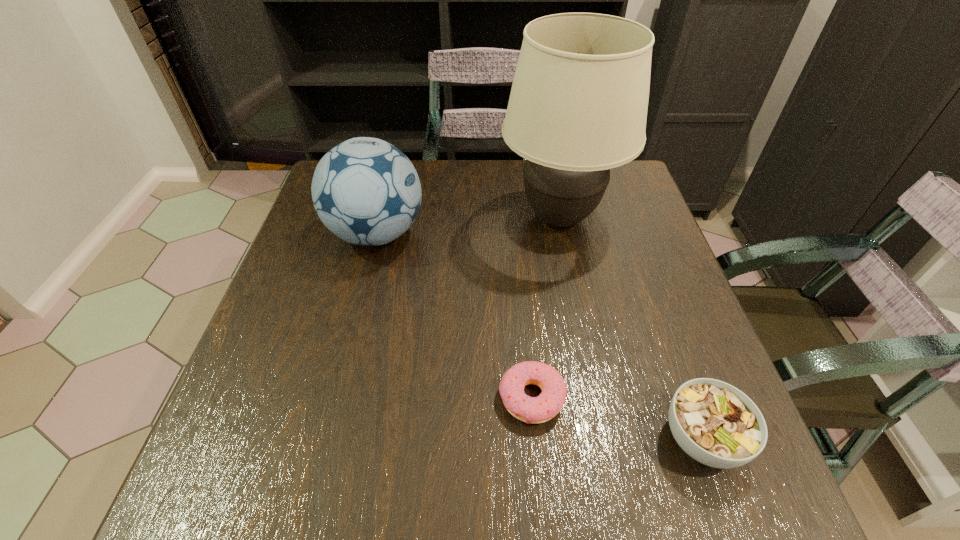
This screenshot has height=540, width=960. Identify the location of the tallest object. (578, 105).

Where is `the leftmost object`? This screenshot has width=960, height=540. the leftmost object is located at coordinates (366, 191).

The height and width of the screenshot is (540, 960). In order to click on soccer ball in this screenshot , I will do `click(366, 191)`.

At what (x,y) coordinates should I click in order to perform the action: click on the second shortest object. Please return your answer as a coordinate pair (x, y). Looking at the image, I should click on (715, 423).

Where is `the shortest object`? the shortest object is located at coordinates (547, 405).

Where is `vacant region located 0.100m on the front of the lampshade`? Image resolution: width=960 pixels, height=540 pixels. vacant region located 0.100m on the front of the lampshade is located at coordinates (573, 291).

Where is `free space located 0.390m on the side with brand of the second tallest object`? This screenshot has height=540, width=960. free space located 0.390m on the side with brand of the second tallest object is located at coordinates (580, 234).

Identify the location of vacant point located 0.290m on the left of the soup bowl. The height and width of the screenshot is (540, 960). (490, 438).

Locate an element on the screen. This screenshot has height=540, width=960. vacant area situated on the left of the doughnut is located at coordinates (278, 398).

Identify the location of lampshade at the far edge. (578, 105).